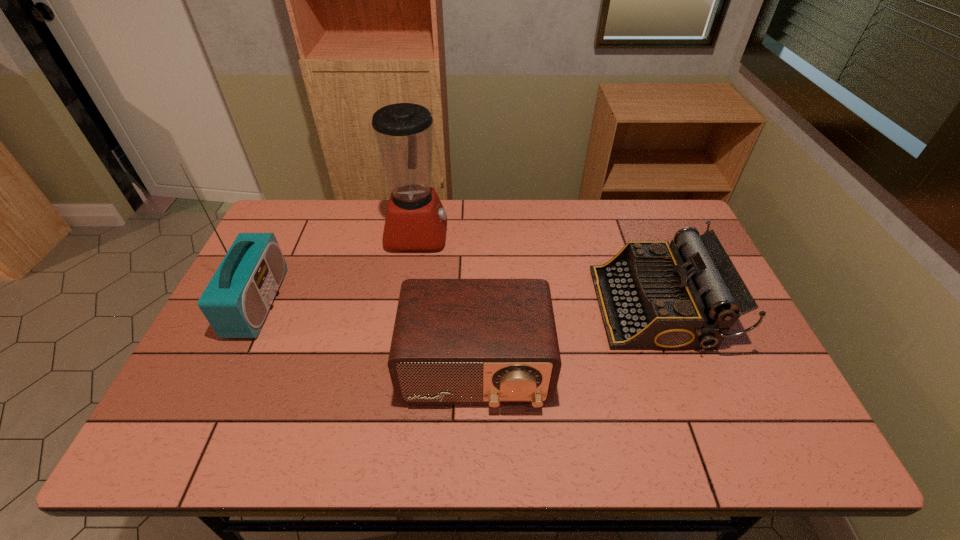
This screenshot has height=540, width=960. I want to click on free space between the right radio receiver and the taller radio receiver, so click(367, 336).

Identify the location of vacant area that lies between the farthest object and the taller radio receiver. (338, 268).

You are a GUI agent. You are given a task and a screenshot of the screen. Output one action in this format:
    pyautogui.click(x=<x>, y=<y>)
    Task: Click on the free space that is in between the farthest object and the rightmost object
    Image resolution: width=960 pixels, height=540 pixels.
    Given the screenshot: What is the action you would take?
    pyautogui.click(x=537, y=271)

I want to click on free point between the farthest object and the leftmost object, so click(338, 268).

Find the location of a particular element. free point between the shorter radio receiver and the rightmost object is located at coordinates (565, 338).

Locate which object is the second closest to the shorter radio receiver. Please provide its 2D coordinates. Your answer should be formatted as a tuple, i.e. [(x, y)], where the tuple contains the x and y coordinates of a point satisfying the conditions above.

[(416, 220)]

Locate which object is the third closest to the rightmost object. Please provide its 2D coordinates. Your answer should be formatted as a tuple, i.e. [(x, y)], where the tuple contains the x and y coordinates of a point satisfying the conditions above.

[(236, 301)]

Locate an element on the screen. The image size is (960, 540). free space that satisfies the following two spatial constraints: 1. on the keyboard of the rightmost object; 2. on the front panel of the right radio receiver is located at coordinates (679, 369).

Identify the location of vacant space that satisfies the following two spatial constraints: 1. on the keyboard of the typewriter; 2. on the front panel of the right radio receiver. Image resolution: width=960 pixels, height=540 pixels. (679, 369).

Locate an element on the screen. vacant position in the image that satisfies the following two spatial constraints: 1. on the keyboard of the typewriter; 2. on the front panel of the right radio receiver is located at coordinates (679, 369).